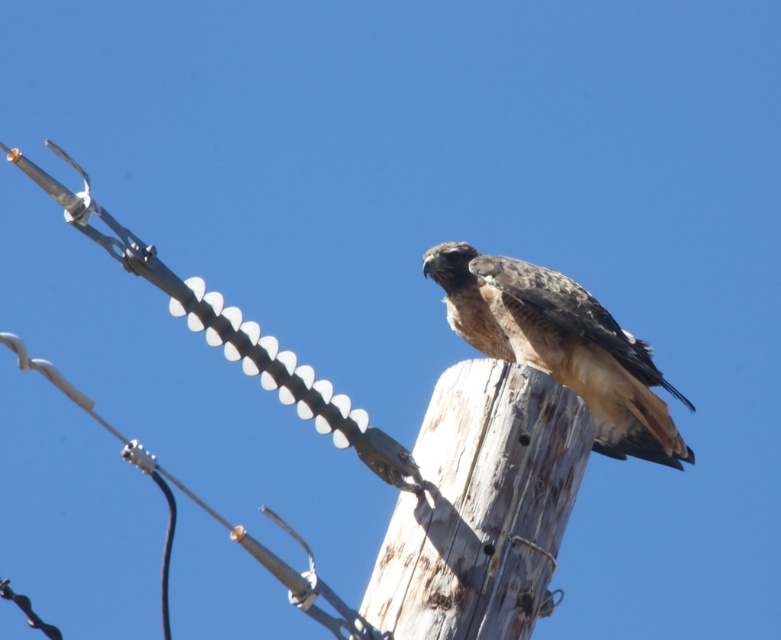
Is point (430, 548) closer to viewer compared to point (487, 344)?

Yes, point (430, 548) is in front of point (487, 344).

Can you confirm if weathered wood pole at center is shorter than brown feathered falcon at center?

Correct, weathered wood pole at center is not as tall as brown feathered falcon at center.

Which is behind, point (553, 419) or point (662, 420)?

Positioned behind is point (662, 420).

The width and height of the screenshot is (781, 640). Identify the location of weathered wood pole at center. (480, 506).